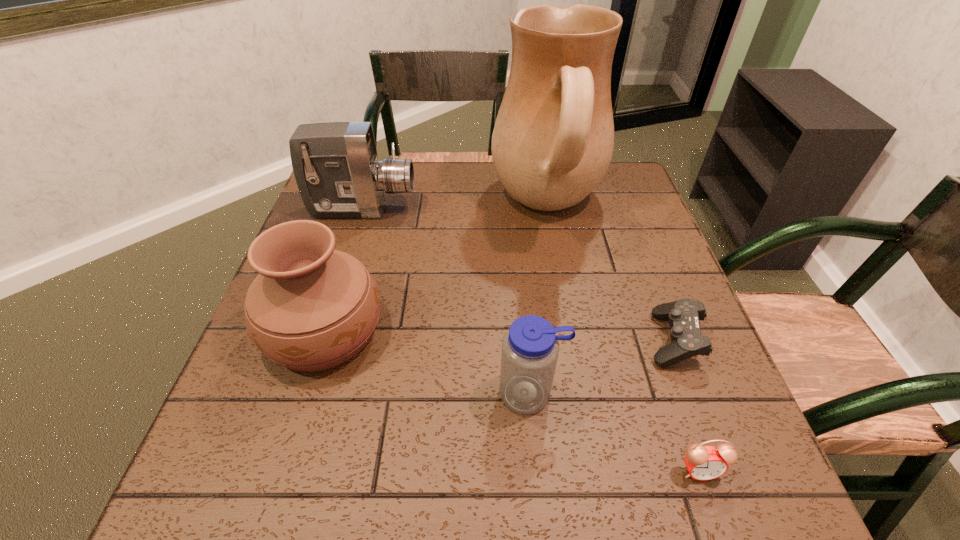
What are the coordinates of `vacant region located at the front of the camcorder, highlighting the lens` in the screenshot? It's located at (516, 210).

Find the location of a particular element. free space located on the back of the urn is located at coordinates (353, 236).

Where is `vacant region located 0.150m with a carrying loop on the side of the third shortest object`? This screenshot has width=960, height=540. vacant region located 0.150m with a carrying loop on the side of the third shortest object is located at coordinates (540, 507).

Where is `free space located on the left of the shortest object`? The height and width of the screenshot is (540, 960). free space located on the left of the shortest object is located at coordinates (465, 339).

This screenshot has width=960, height=540. Identify the location of cream pitcher at the far edge. (553, 140).

I want to click on camcorder at the far edge, so click(335, 164).

This screenshot has height=540, width=960. What are the coordinates of `object positioned at the near edge` in the screenshot? It's located at (704, 463).

Find the location of a particular element. This screenshot has height=540, width=960. camcorder present at the left edge is located at coordinates tap(335, 164).

Identify the location of urn positioned at the left edge. (311, 308).

I want to click on cream pitcher at the right edge, so click(x=553, y=140).